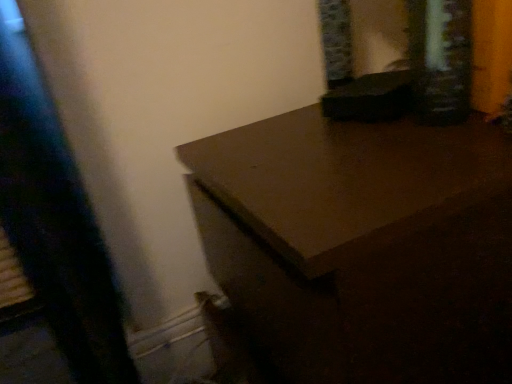
Find the location of a particular element. This screenshot has width=512, height=384. matte brown table at lower right is located at coordinates (362, 247).

The width and height of the screenshot is (512, 384). What do you see at coordinates (362, 247) in the screenshot?
I see `matte brown table at lower right` at bounding box center [362, 247].

In the scene shown: Measure the distance between matte brown table at lower right and camera.

The depth of matte brown table at lower right is 13.72 inches.

You are a GUI agent. You are given a task and a screenshot of the screen. Output one action in this format:
    pyautogui.click(x=<x>, y=<y>)
    Task: Click on the matte brown table at lower right
    The width and height of the screenshot is (512, 384).
    Given the screenshot: What is the action you would take?
    pyautogui.click(x=362, y=247)